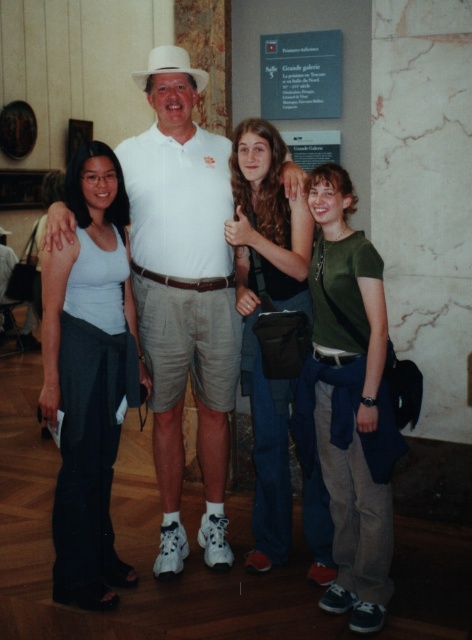
Question: Which of these objects is positioned closest to the white matte cowboy hat at center?

Choices:
 (A) green matte shirt at right
 (B) white cotton shirt at center
 (C) green cotton shirt at center

Answer: (B)

Question: Among these points, which one is nearest to the camera?

Choices:
 (A) (145, 81)
 (B) (55, 285)

Answer: (B)

Question: Is white matte tank top at left to the left of green cotton shirt at center from the viewer's perspective?

Choices:
 (A) no
 (B) yes

Answer: (B)

Question: Is green matte shirt at right to the left of green cotton shirt at center from the viewer's perspective?

Choices:
 (A) no
 (B) yes

Answer: (A)

Question: Where is white matte tank top at left located in relation to white matte cowboy hat at center in the image?

Choices:
 (A) above
 (B) below

Answer: (B)

Question: Which of these objects is positioned closest to the white matte cowboy hat at center?

Choices:
 (A) white matte tank top at left
 (B) white cotton shirt at center
 (C) green matte shirt at right

Answer: (B)